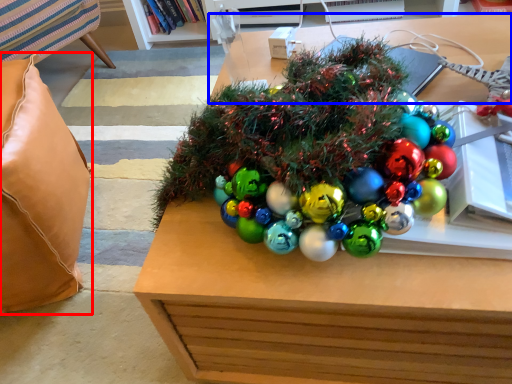
Question: Which object appears closest to the camera in this image, pillow (highlighted by a red box) or table (highlighted by a blue box)?

Choices:
 (A) pillow
 (B) table

Answer: (B)